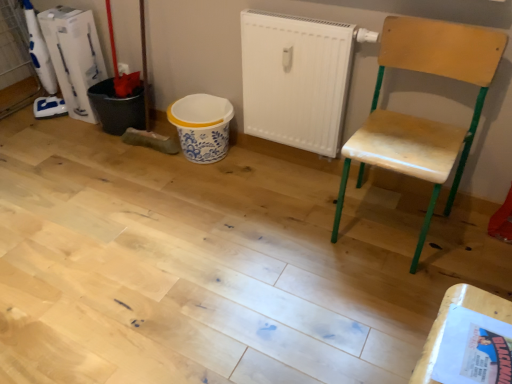
At what (x,y) coordinates should I click in order to perform the action: click on blank area to the left of wooden chair at right. Please return your answer as a coordinate pair (x, y). The image size is (512, 384). Looking at the image, I should click on (293, 229).